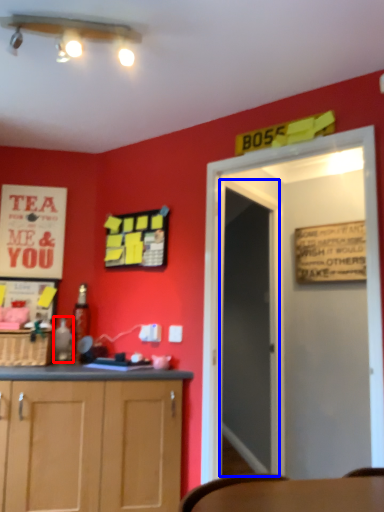
Question: Which of the following is the farthest to the observer, bottle (highlighted by a red box) or glass door (highlighted by a blue box)?

Choices:
 (A) bottle
 (B) glass door

Answer: (A)